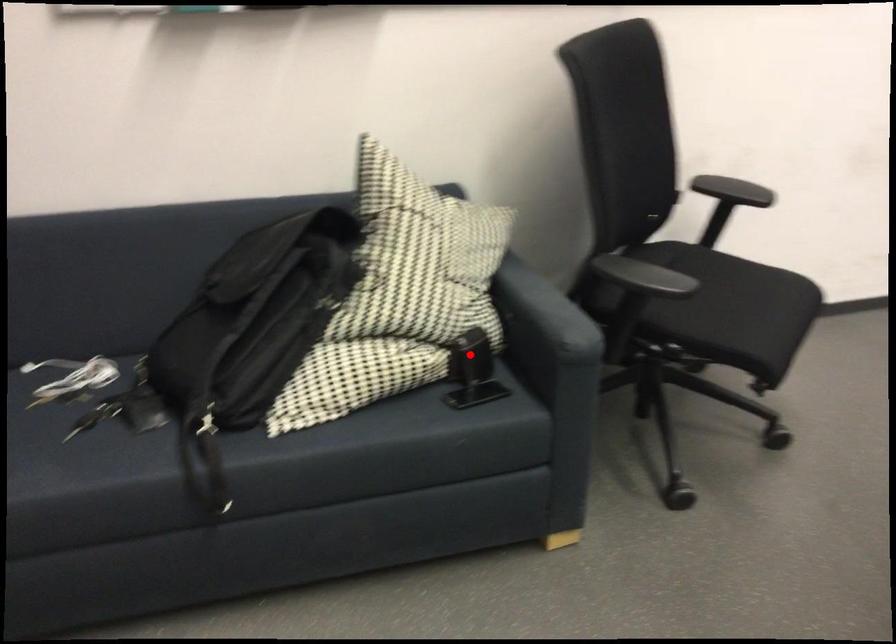
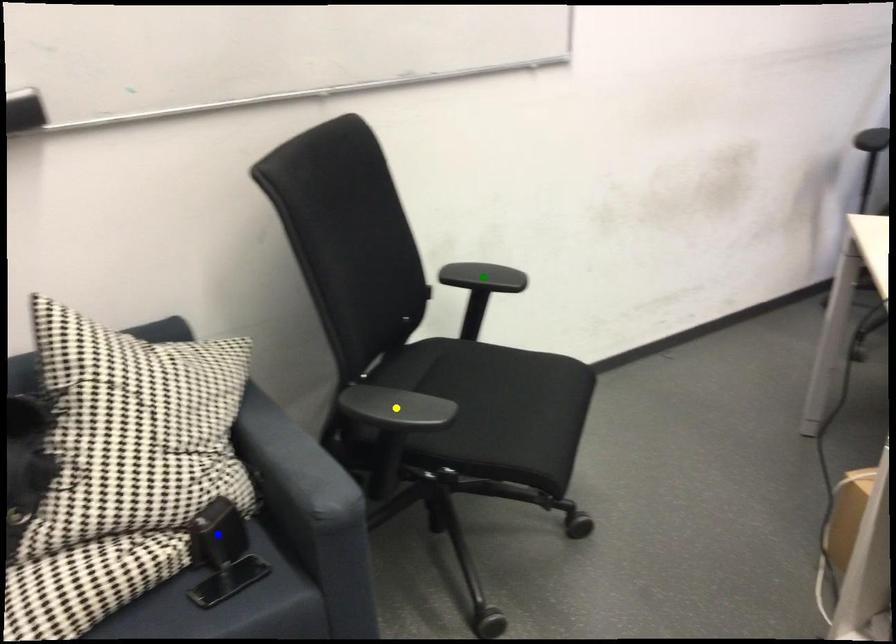
Question: I am providing you with two images of the same scene from different viewpoints. A red point is marked on the first image. You are given multiple points on the second image. In image 2, which mark is for the same physical point as the one in image 1?

Choices:
 (A) green point
 (B) blue point
 (C) yellow point

Answer: (B)